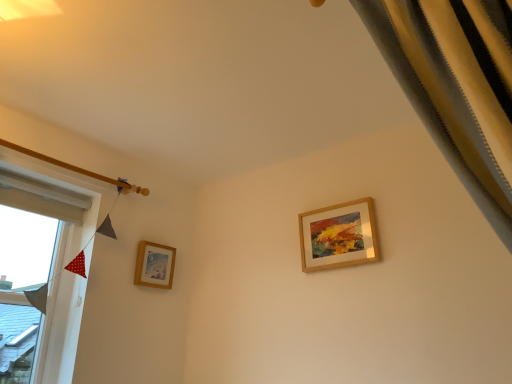
Question: Looking at the image, does white fabric at left seem bigger or smaller compared to wooden picture frame at lower left, placed as the second picture frame when sorted from right to left?

Choices:
 (A) big
 (B) small

Answer: (A)

Question: From a real-world perspective, relative to wooden picture frame at lower left, the first picture frame in the left-to-right sequence, is white fabric at left vertically above or below?

Choices:
 (A) above
 (B) below

Answer: (B)

Question: Estimate the real-world distances between objects in this image. Which object is farther from the silky yellow curtain at upper right?

Choices:
 (A) wooden picture frame at upper right, the 1th picture frame in the right-to-left sequence
 (B) wooden picture frame at lower left, placed as the second picture frame when sorted from right to left
 (C) white fabric at left

Answer: (B)

Question: Which object is the closest to the silky yellow curtain at upper right?

Choices:
 (A) white fabric at left
 (B) wooden picture frame at upper right, acting as the 2th picture frame starting from the left
 (C) wooden picture frame at lower left, acting as the 1th picture frame starting from the back

Answer: (B)